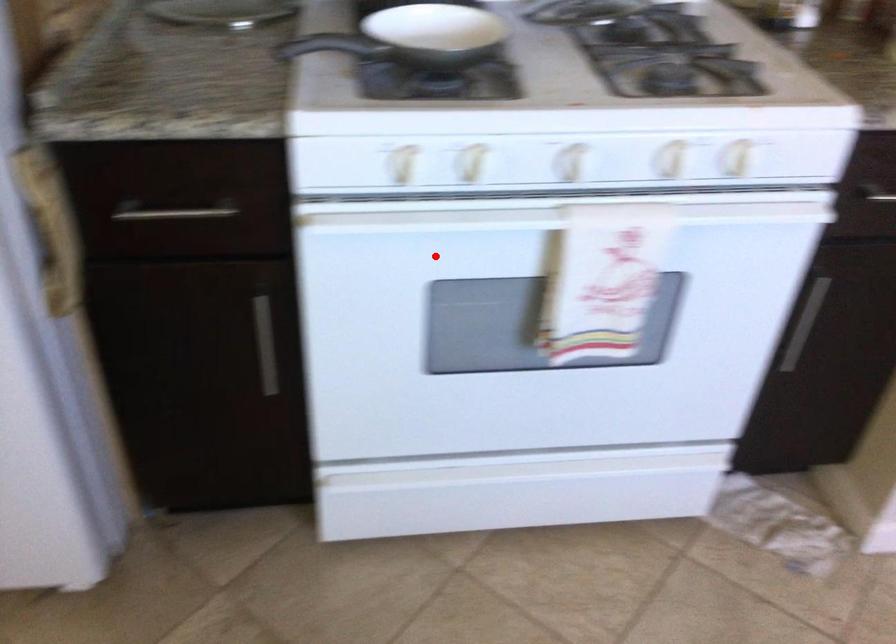
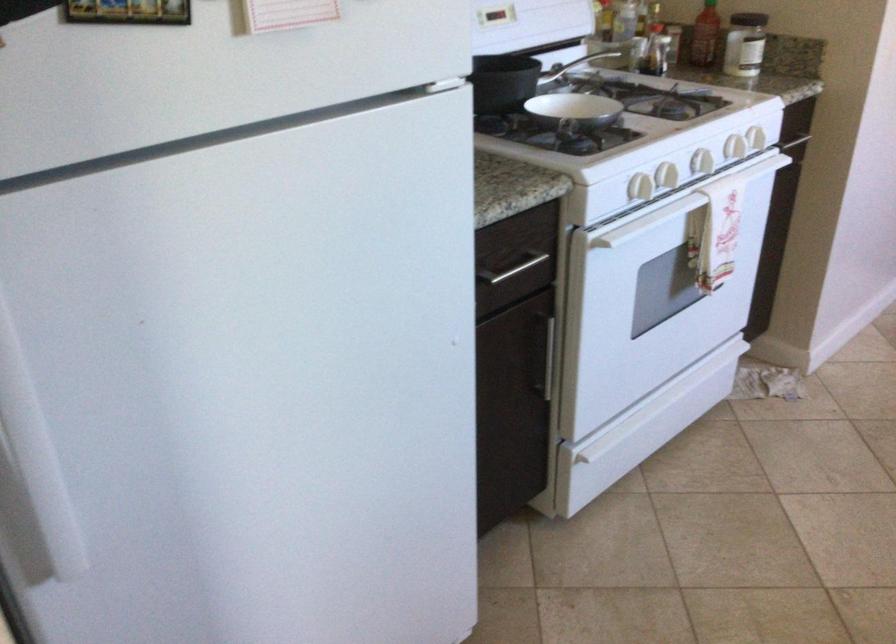
Find the pixel in the second image that matches the highlighted location in the first image.

(679, 205)